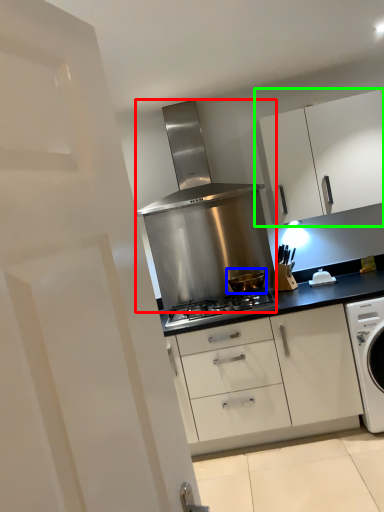
Question: Which object is the farthest from home appliance (highlighted by a red box)? Choose among these: kitchen appliance (highlighted by a blue box) or cabinetry (highlighted by a green box).

Choices:
 (A) kitchen appliance
 (B) cabinetry

Answer: (B)